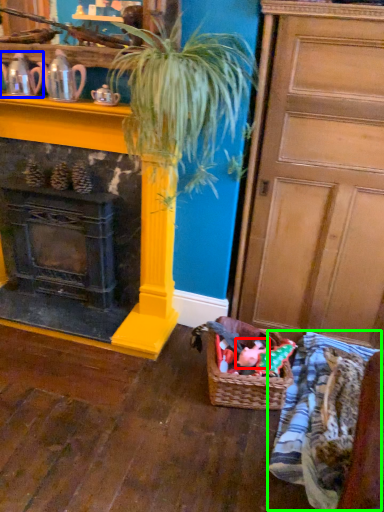
Question: Which object is the farthest from toy (highlighted by a red box)? Choose among these: tea pot (highlighted by a blue box) or clothing (highlighted by a green box).

Choices:
 (A) tea pot
 (B) clothing

Answer: (A)